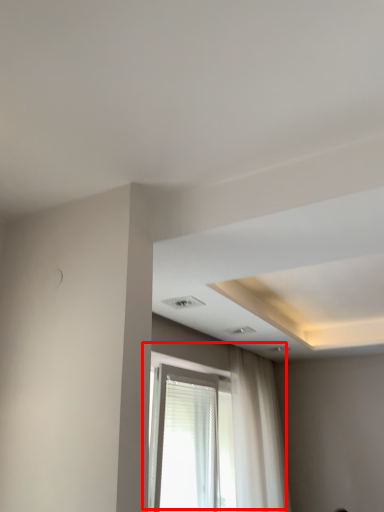
Question: In this image, where is window (annotated by the red box) located relative to curtain?

Choices:
 (A) right
 (B) left

Answer: (B)